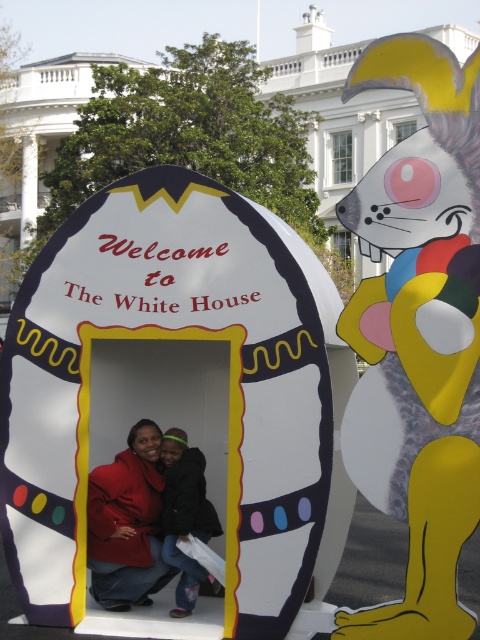
You are standing in front of the White House Easter display and notice two points marked in the scene. Which of these points, point 1 at coordinates (133, 536) or point 2 at coordinates (168, 444), is closer to you?

Point 1 at coordinates (133, 536) is closer to the viewer than point 2 at coordinates (168, 444).

You are a photographer standing at the camera position. You want to take a photo of the matte yellow and gray cat at right. If your camera has a maximum focus range of 10 meters, will you be able to capture the cat clearly?

The matte yellow and gray cat at right and camera are 10.89 meters apart. Since the camera can only focus up to 10 meters, the distance is too far to capture the cat clearly.